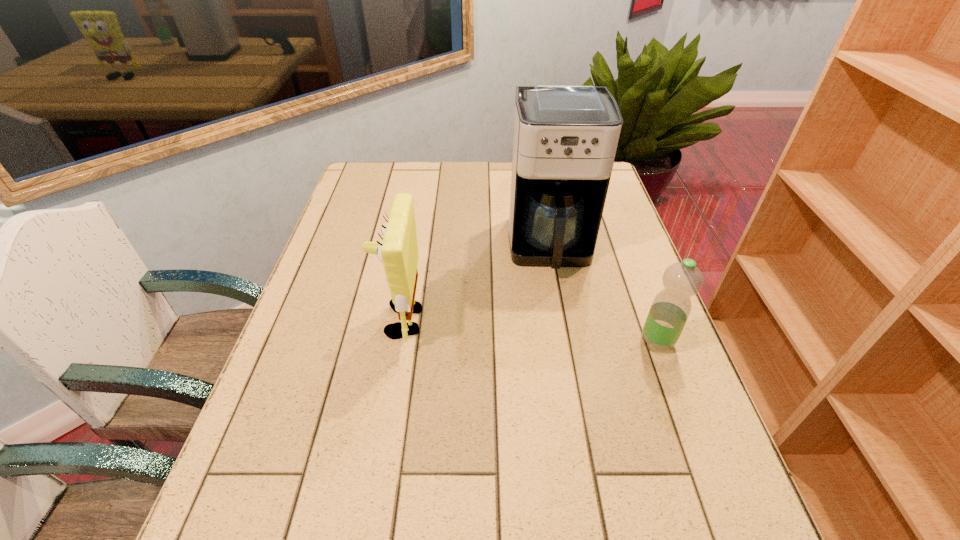
What are the coordinates of `vacant space that is in between the sponge and the coffee maker` in the screenshot? It's located at (475, 284).

Identify the location of vacant area that lies between the second shortest object and the coffee maker. The width and height of the screenshot is (960, 540). (475, 284).

This screenshot has width=960, height=540. In order to click on free spot between the leftmost object and the water bottle in this screenshot , I will do `click(528, 331)`.

Find the location of `vacant area that lies between the tallest object and the second shortest object`. vacant area that lies between the tallest object and the second shortest object is located at coordinates (475, 284).

Locate an element on the screen. The image size is (960, 540). free area in between the tallest object and the second shortest object is located at coordinates (475, 284).

The image size is (960, 540). Identify the location of object that is the closest one to the sponge. (565, 139).

Identify the location of the second closest object to the second shortest object. (670, 309).